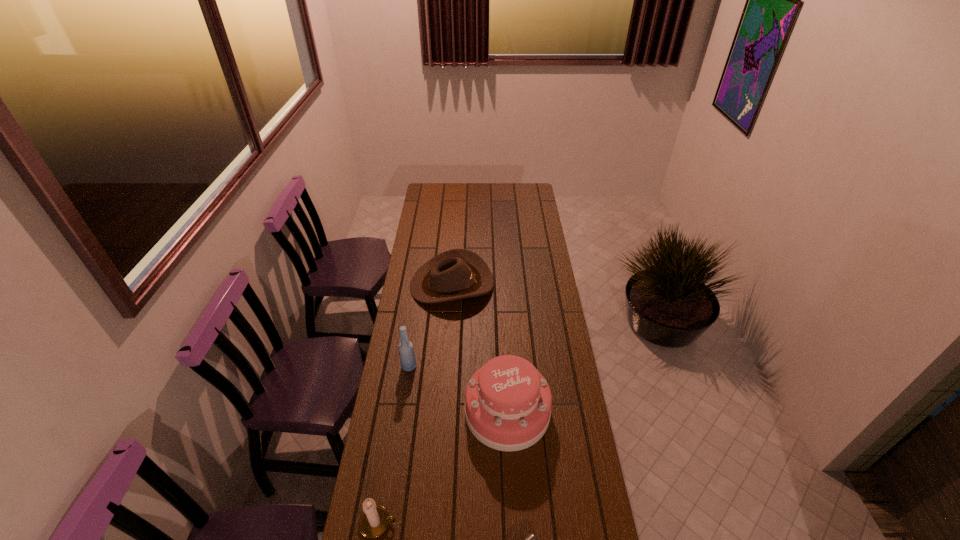
Find the location of a particular element. This screenshot has height=540, width=960. candle holder that is positioned at the left edge is located at coordinates (374, 520).

This screenshot has height=540, width=960. I want to click on object that is at the right edge, so click(x=508, y=402).

Identify the location of vacant region at the far edge. Image resolution: width=960 pixels, height=540 pixels. (500, 201).

Locate an element on the screen. vacant space at the left edge of the desktop is located at coordinates (426, 220).

This screenshot has height=540, width=960. In the image, there is a desktop. In order to click on free space at the right edge in this screenshot , I will do `click(545, 303)`.

Locate an element on the screen. vacant position at the far left corner of the desktop is located at coordinates click(447, 193).

Where is `vacant space that is in between the birthday cake and the bottle`? vacant space that is in between the birthday cake and the bottle is located at coordinates (458, 389).

The width and height of the screenshot is (960, 540). Find the location of `vacant area between the second farthest object and the birthday cake`. vacant area between the second farthest object and the birthday cake is located at coordinates (458, 389).

Image resolution: width=960 pixels, height=540 pixels. I want to click on vacant area between the second farthest object and the farthest object, so click(430, 325).

Find the location of a particular element. The image size is (960, 540). empty space that is in between the cowboy hat and the birthday cake is located at coordinates (480, 348).